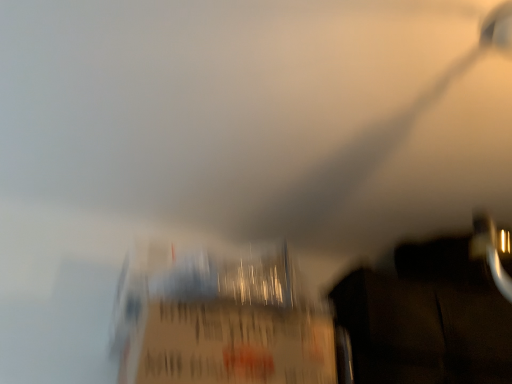
Question: From a real-world perspective, is dark matte wood drawer at lower right physically located above or below matte cardboard box at center?

Choices:
 (A) above
 (B) below

Answer: (A)

Question: Which is correct: dark matte wood drawer at lower right is inside matte cardboard box at center, or outside of it?

Choices:
 (A) outside
 (B) inside

Answer: (A)

Question: Relative to matte cardboard box at center, is dark matte wood drawer at lower right in front or behind?

Choices:
 (A) behind
 (B) front

Answer: (A)

Question: Considering the relative positions of matte cardboard box at center and dark matte wood drawer at lower right in the image provided, is matte cardboard box at center to the left or to the right of dark matte wood drawer at lower right?

Choices:
 (A) left
 (B) right

Answer: (A)

Question: Does point (287, 367) appear closer or farther from the camera than point (373, 301)?

Choices:
 (A) closer
 (B) farther

Answer: (A)

Question: In terms of size, does matte cardboard box at center appear bigger or smaller than dark matte wood drawer at lower right?

Choices:
 (A) big
 (B) small

Answer: (B)

Question: Choose the correct answer: Is matte cardboard box at center inside dark matte wood drawer at lower right or outside it?

Choices:
 (A) outside
 (B) inside

Answer: (A)